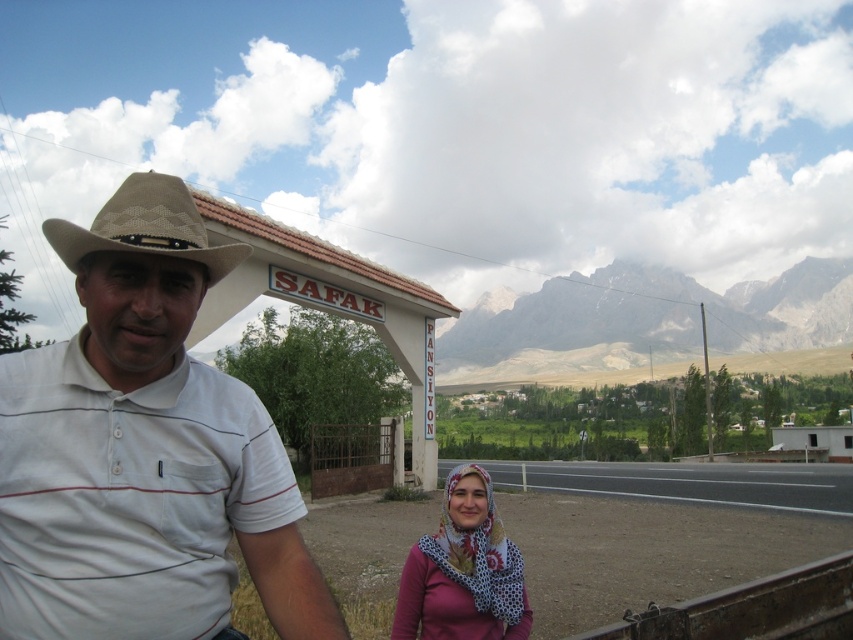
Is rugged stone mountain at upper center closer to camera compared to tan woven cowboy hat at left?

No.

Is rugged stone mountain at upper center taller than tan woven cowboy hat at left?

Correct, rugged stone mountain at upper center is much taller as tan woven cowboy hat at left.

I want to click on rugged stone mountain at upper center, so click(x=645, y=320).

Is the position of white matte shirt at center more distant than that of tan woven cowboy hat at left?

No, it is not.

Is point (183, 636) farther from camera compared to point (184, 218)?

No, it is not.

Locate an element on the screen. Image resolution: width=853 pixels, height=640 pixels. white matte shirt at center is located at coordinates (143, 451).

Which is more to the left, rugged stone mountain at upper center or printed cotton scarf at lower center?

From the viewer's perspective, printed cotton scarf at lower center appears more on the left side.

Is rugged stone mountain at upper center positioned before printed cotton scarf at lower center?

That is False.

Describe the element at coordinates (645, 320) in the screenshot. This screenshot has width=853, height=640. I see `rugged stone mountain at upper center` at that location.

The image size is (853, 640). Find the location of `rugged stone mountain at upper center`. rugged stone mountain at upper center is located at coordinates (645, 320).